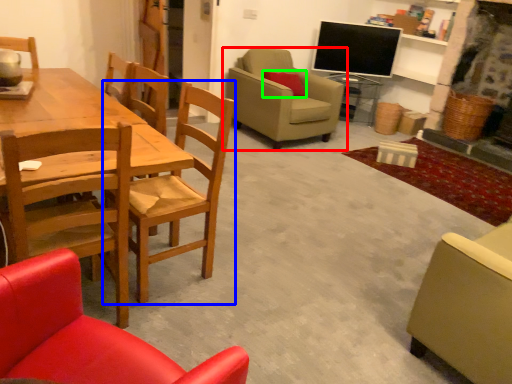
Question: Considering the real-world distances, which object is farthest from chair (highlighted by a red box)? chair (highlighted by a blue box) or pillow (highlighted by a green box)?

Choices:
 (A) chair
 (B) pillow

Answer: (A)